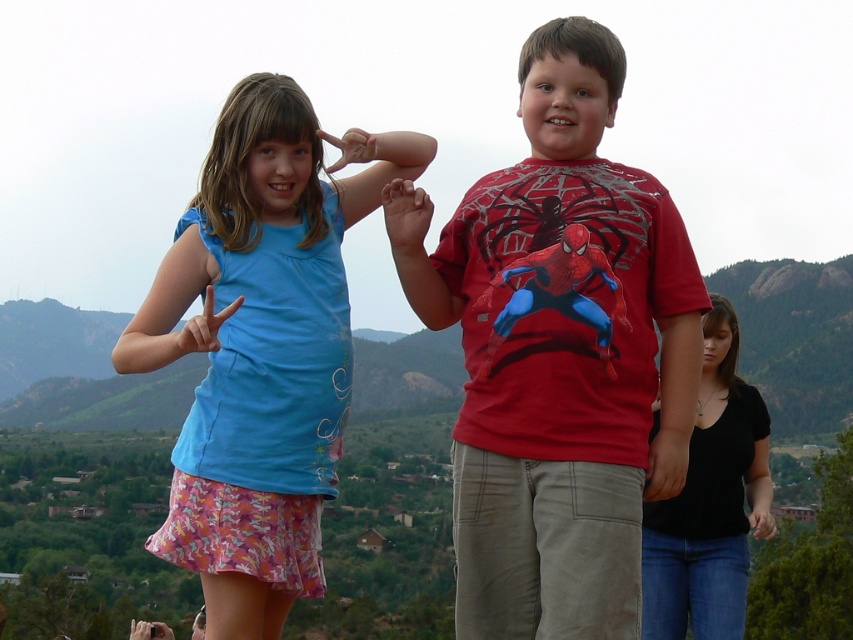
Question: Does matte spider-man t-shirt at center come in front of matte blue shirt at center?

Choices:
 (A) no
 (B) yes

Answer: (B)

Question: Can you confirm if matte spider-man t-shirt at center is bigger than matte blue shirt at center?

Choices:
 (A) yes
 (B) no

Answer: (A)

Question: Does matte spider-man t-shirt at center lie behind matte blue shirt at center?

Choices:
 (A) no
 (B) yes

Answer: (A)